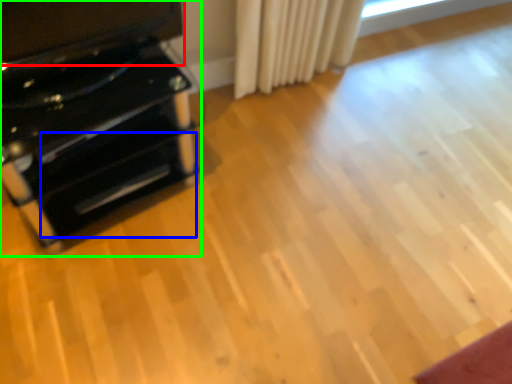
Question: Estimate the real-world distances between objects in this image. Which object is closer to wide (highlighted by a red box), drawer (highlighted by a blue box) or furniture (highlighted by a green box)?

Choices:
 (A) drawer
 (B) furniture

Answer: (B)